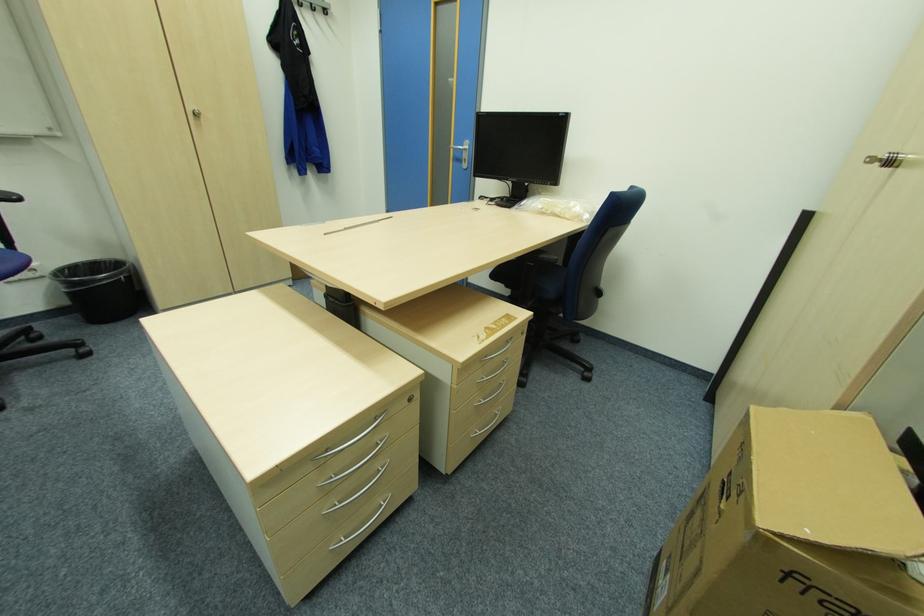
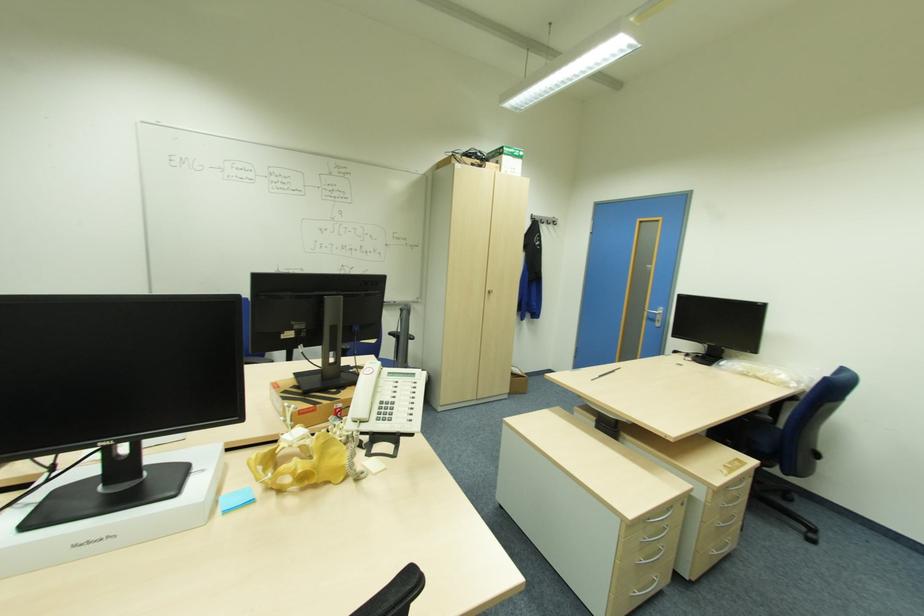
In the second image, find the point that corresponds to the point at 535,264 in the first image.

(750, 419)